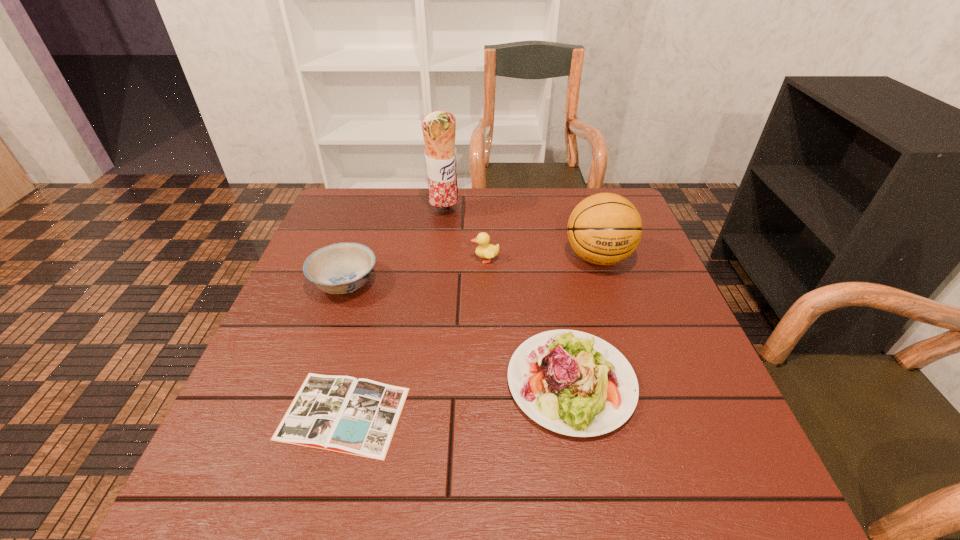
Locate an element on the screen. The width and height of the screenshot is (960, 540). vacant space that satisfies the following two spatial constraints: 1. on the front-facing side of the third tallest object; 2. on the front side of the bowl is located at coordinates (486, 283).

Image resolution: width=960 pixels, height=540 pixels. Identify the location of free space in the image that satisfies the following two spatial constraints: 1. on the back side of the tallest object; 2. on the right side of the fourth tallest object. (370, 212).